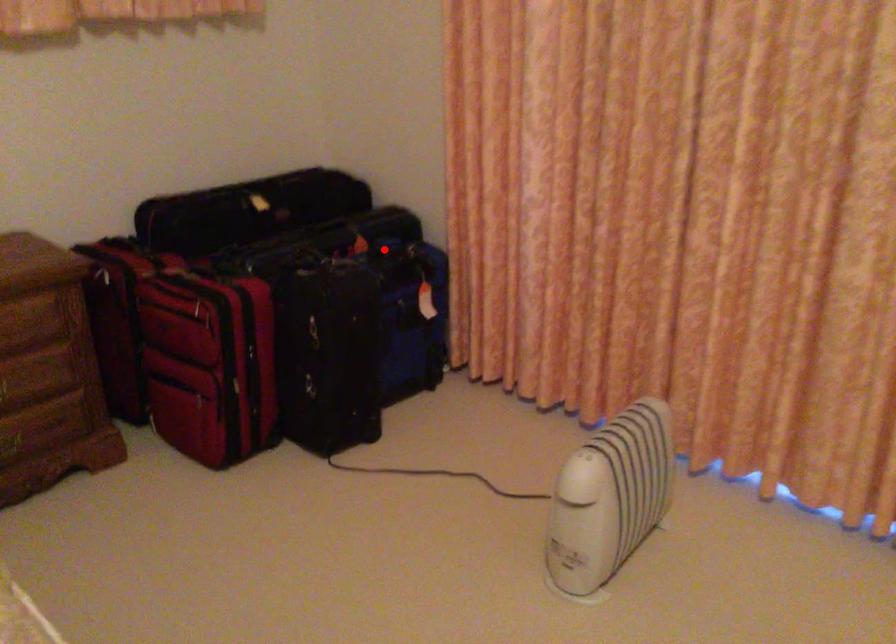
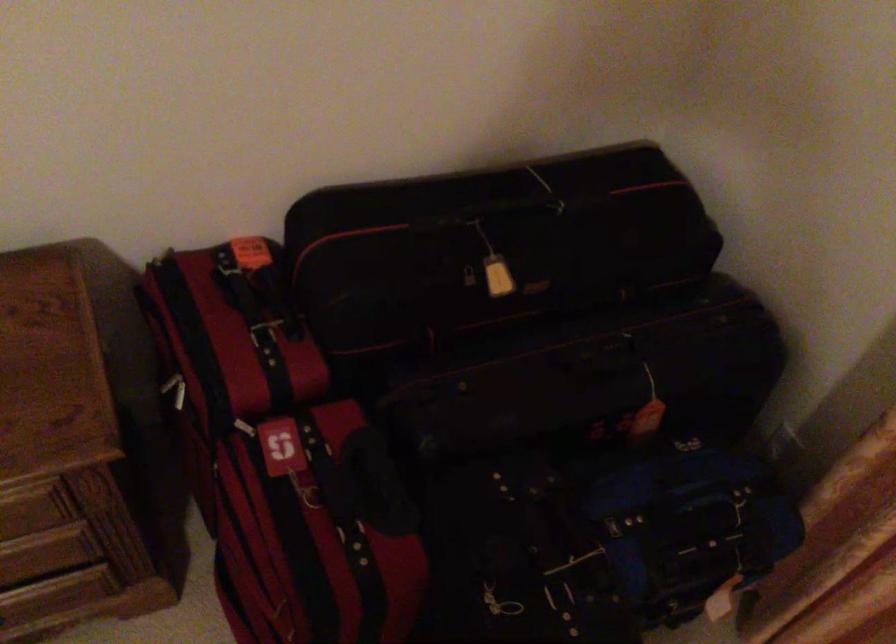
Question: A red point is marked in image1. In image2, is the corresponding 3D point closer to the camera or farther? Reply with the corresponding letter.

Choices:
 (A) The corresponding 3D point is closer.
 (B) The corresponding 3D point is farther.

Answer: (A)